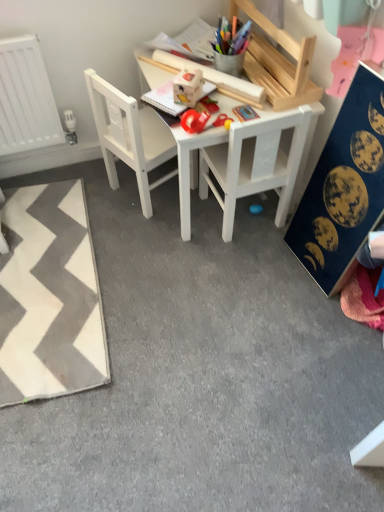
Question: From the image's perspective, is white zigzag rug at lower left located above white wooden table at center?

Choices:
 (A) yes
 (B) no

Answer: (B)

Question: Does white zigzag rug at lower left appear on the left side of white wooden table at center?

Choices:
 (A) no
 (B) yes

Answer: (B)

Question: Does white zigzag rug at lower left have a larger size compared to white wooden table at center?

Choices:
 (A) yes
 (B) no

Answer: (B)

Question: From a real-world perspective, is white zigzag rug at lower left on white wooden table at center?

Choices:
 (A) yes
 (B) no

Answer: (B)

Question: From a real-world perspective, is white zigzag rug at lower left under white wooden table at center?

Choices:
 (A) no
 (B) yes

Answer: (B)

Question: From the image's perspective, is white matte chair at center, which ranks as the 1th chair in left-to-right order, above or below dark blue fabric with celestial prints at right?

Choices:
 (A) below
 (B) above

Answer: (B)

Question: From a real-world perspective, is white matte chair at center, the second chair from the right, above or below dark blue fabric with celestial prints at right?

Choices:
 (A) above
 (B) below

Answer: (B)

Question: Based on their sizes in the image, would you say white matte chair at center, which ranks as the 1th chair in left-to-right order, is bigger or smaller than dark blue fabric with celestial prints at right?

Choices:
 (A) big
 (B) small

Answer: (A)

Question: Which is correct: white matte chair at center, the second chair from the right, is inside dark blue fabric with celestial prints at right, or outside of it?

Choices:
 (A) inside
 (B) outside

Answer: (B)

Question: From the image's perspective, relative to white wooden table at center, is white matte chair at center, placed as the second chair when sorted from left to right, above or below?

Choices:
 (A) below
 (B) above

Answer: (A)

Question: Looking at the image, does white matte chair at center, which is the first chair in right-to-left order, seem bigger or smaller compared to white wooden table at center?

Choices:
 (A) big
 (B) small

Answer: (B)

Question: Considering their positions, is white matte chair at center, which is the first chair in right-to-left order, located in front of or behind white wooden table at center?

Choices:
 (A) behind
 (B) front

Answer: (B)

Question: Is white matte chair at center, placed as the second chair when sorted from left to right, wider or thinner than white wooden table at center?

Choices:
 (A) wide
 (B) thin

Answer: (B)

Question: In terms of width, does white zigzag rug at lower left look wider or thinner when compared to white wooden table at center?

Choices:
 (A) wide
 (B) thin

Answer: (A)

Question: From the image's perspective, is white zigzag rug at lower left above or below white wooden table at center?

Choices:
 (A) above
 (B) below

Answer: (B)